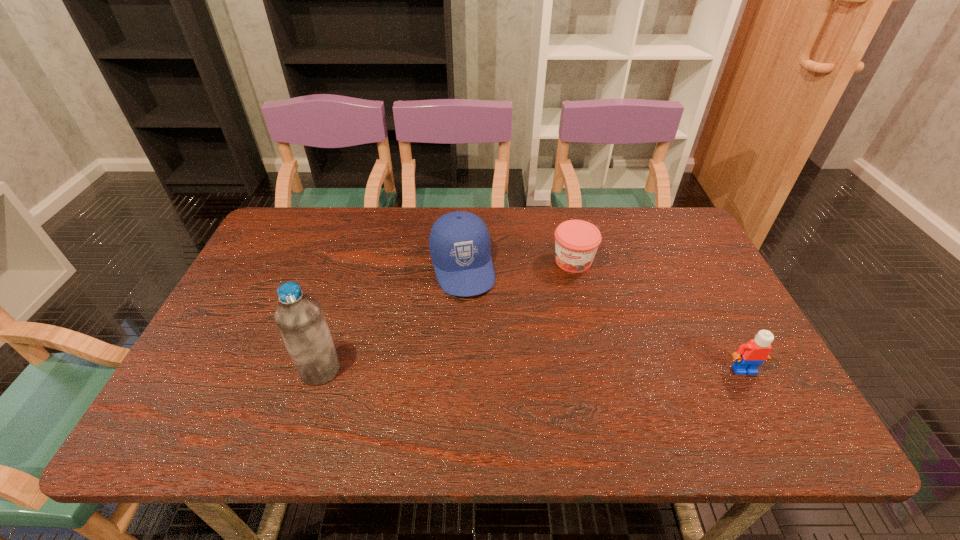
Locate an element on the screen. This screenshot has width=960, height=540. the tallest object is located at coordinates (300, 320).

Identify the location of the leftmost object. (300, 320).

Where is `the rightmost object`? The image size is (960, 540). the rightmost object is located at coordinates (748, 357).

The width and height of the screenshot is (960, 540). I want to click on the third object from right to left, so click(x=459, y=242).

At what (x,y) coordinates should I click in order to perform the action: click on the third object from left to right. Please return your answer as a coordinate pair (x, y). Looking at the image, I should click on (576, 241).

Locate an element on the screen. The height and width of the screenshot is (540, 960). jam is located at coordinates (576, 241).

Where is `vacant space located 0.320m on the right of the tallest object`? This screenshot has width=960, height=540. vacant space located 0.320m on the right of the tallest object is located at coordinates (478, 370).

Image resolution: width=960 pixels, height=540 pixels. I want to click on vacant area located 0.060m on the face of the Lego, so click(x=758, y=399).

I want to click on free space located on the front-facing side of the third object from right to left, so click(x=476, y=323).

This screenshot has height=540, width=960. Identify the location of free region located 0.070m on the front-facing side of the third object from right to left. (474, 318).